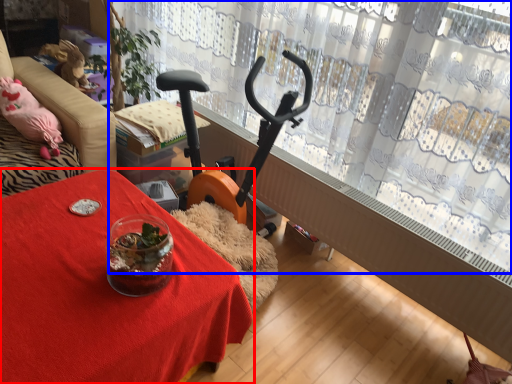
Question: Which object appears closest to the camera in this image, table (highlighted by a red box) or curtain (highlighted by a blue box)?

Choices:
 (A) table
 (B) curtain

Answer: (A)